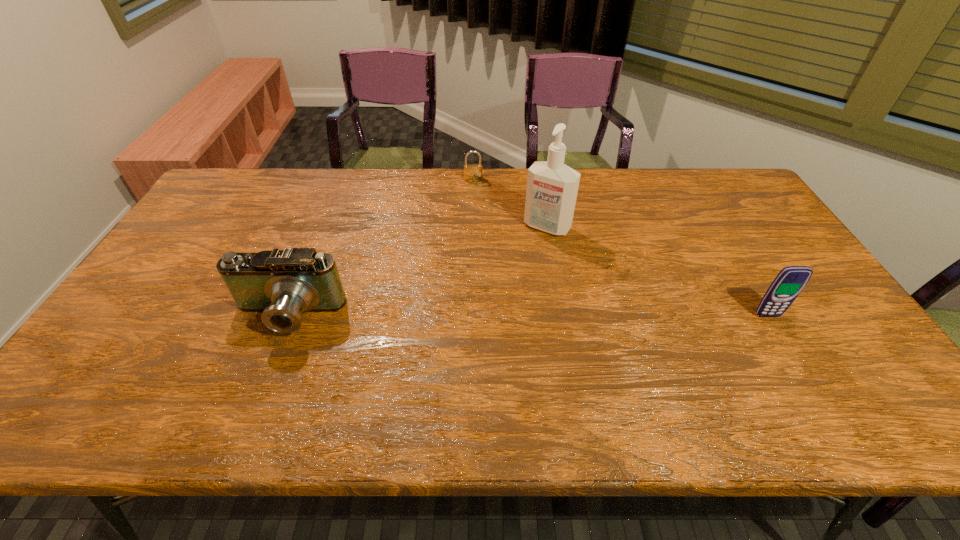
At what (x,y) coordinates should I click in order to perform the action: click on the leftmost object. Please return your answer as a coordinate pair (x, y). Looking at the image, I should click on (280, 283).

The height and width of the screenshot is (540, 960). I want to click on the rightmost object, so click(x=790, y=281).

Image resolution: width=960 pixels, height=540 pixels. In order to click on the tallest object in this screenshot , I will do `click(552, 187)`.

At what (x,y) coordinates should I click in order to perform the action: click on cleansing agent. Please return your answer as a coordinate pair (x, y). Image resolution: width=960 pixels, height=540 pixels. Looking at the image, I should click on (552, 187).

Locate an element on the screen. The width and height of the screenshot is (960, 540). the farthest object is located at coordinates (472, 172).

The height and width of the screenshot is (540, 960). What are the coordinates of `the third object from right to left` in the screenshot? It's located at (472, 172).

Identify the location of free space located on the front-facing side of the camcorder. The image size is (960, 540). (264, 375).

Image resolution: width=960 pixels, height=540 pixels. What are the coordinates of `vacant space situated on the front-facing side of the cellular telephone` in the screenshot? It's located at (797, 364).

I want to click on vacant space located 0.150m on the front label of the tallest object, so pyautogui.click(x=516, y=266).

Where is `vacant space located on the front label of the tallest object`? vacant space located on the front label of the tallest object is located at coordinates click(528, 250).